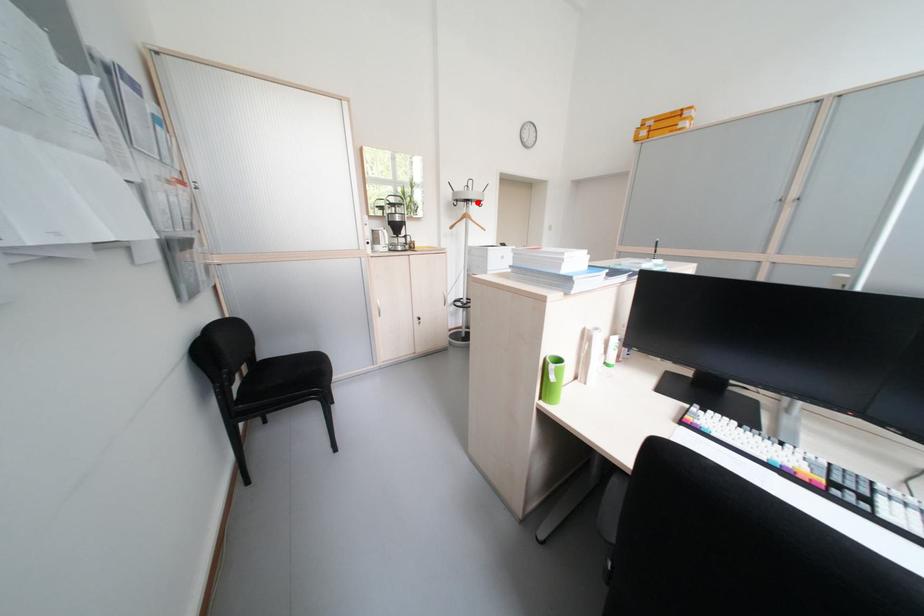
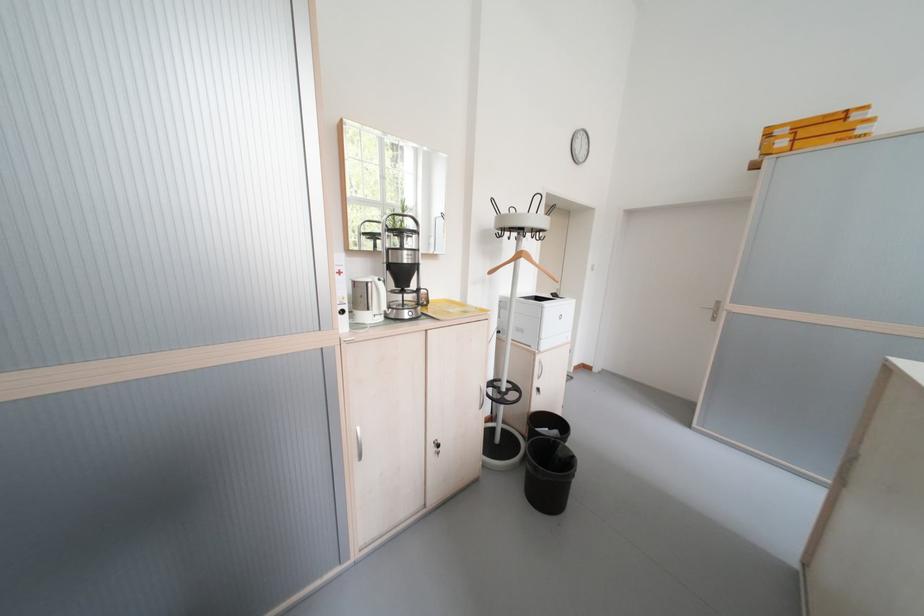
Find the pixel in the second image that matches the highlighted location in the first image.

(531, 232)